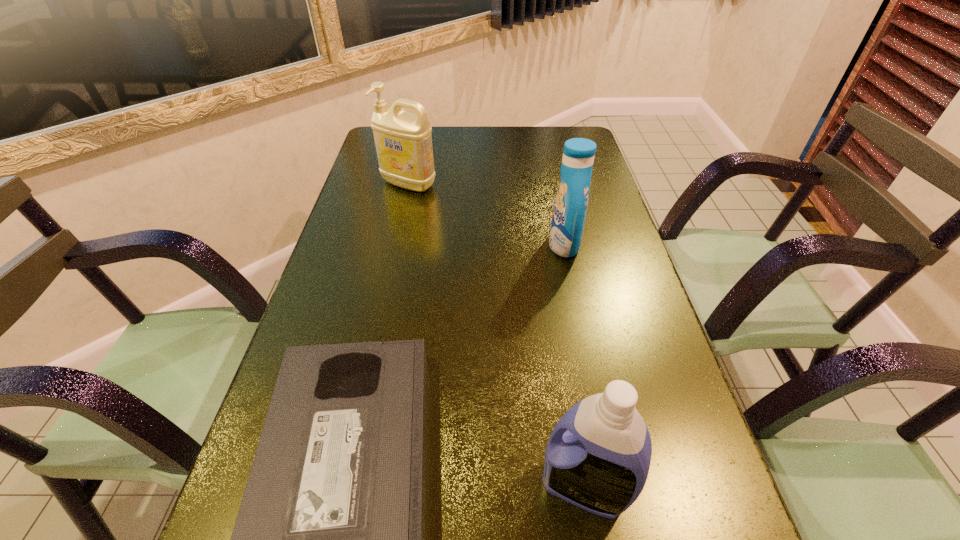
Where is `free location at the far edge`? The image size is (960, 540). free location at the far edge is located at coordinates (493, 136).

Locate an element on the screen. This screenshot has width=960, height=540. vacant space at the left edge of the desktop is located at coordinates (351, 332).

The height and width of the screenshot is (540, 960). In the image, there is a desktop. In order to click on vacant space at the right edge in this screenshot , I will do `click(659, 349)`.

This screenshot has width=960, height=540. In the image, there is a desktop. Identify the location of free region at the far right corner. (543, 156).

Where is `blank region between the nearest detergent and the farthest detergent`? blank region between the nearest detergent and the farthest detergent is located at coordinates (496, 336).

The width and height of the screenshot is (960, 540). What are the coordinates of `free spot between the nearest detergent and the second farthest object` in the screenshot? It's located at (574, 366).

At what (x,y) coordinates should I click in order to perform the action: click on vacant space that is in between the nearest detergent and the second nearest detergent. Please return your answer as a coordinate pair (x, y). The height and width of the screenshot is (540, 960). Looking at the image, I should click on (574, 366).

Where is `empty space between the nearest detergent and the leftmost detergent`? The image size is (960, 540). empty space between the nearest detergent and the leftmost detergent is located at coordinates (x=496, y=336).

The height and width of the screenshot is (540, 960). Find the location of `vacant area that lies between the leftmost detergent and the nearest detergent`. vacant area that lies between the leftmost detergent and the nearest detergent is located at coordinates (496, 336).

Find the location of a particular element. empty space that is in between the nearest detergent and the farthest object is located at coordinates (496, 336).